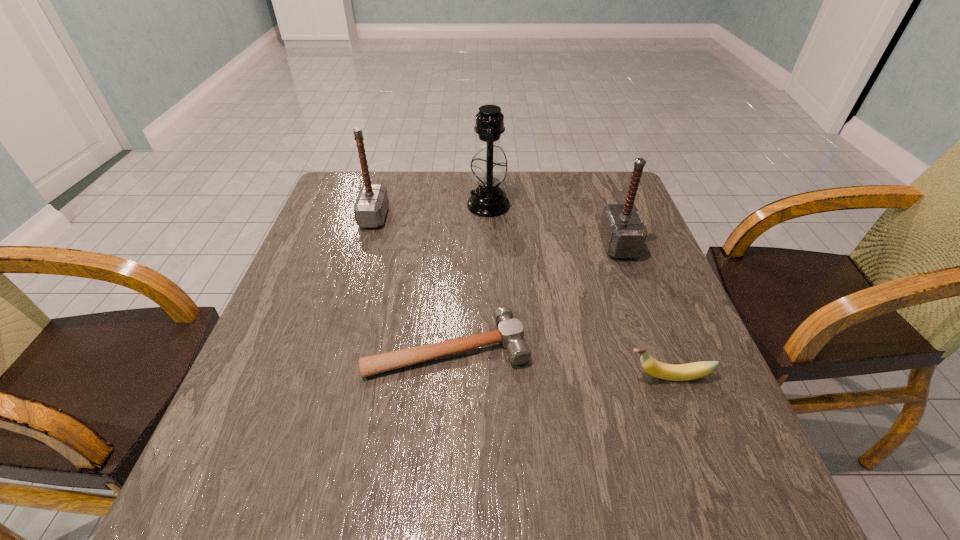
Identify the location of free space at the near edge. Image resolution: width=960 pixels, height=540 pixels. (623, 521).

Find the location of `free location at the left edge`. free location at the left edge is located at coordinates (311, 411).

The width and height of the screenshot is (960, 540). I want to click on vacant region at the right edge of the desktop, so click(609, 270).

At what (x,y) coordinates should I click in order to perform the action: click on vacant space at the far left corner of the desktop. Please return your answer as a coordinate pair (x, y). Looking at the image, I should click on (348, 208).

Find the location of `blank area at the near left corner`. blank area at the near left corner is located at coordinates [x=222, y=488].

This screenshot has width=960, height=540. Identify the location of vacant point located between the leftmost object and the shortest hammer. (411, 281).

The image size is (960, 540). I want to click on vacant point located between the rightmost hammer and the shortest object, so click(x=533, y=295).

Where is `unoccupied area between the leftmost hammer and the oil lamp`? This screenshot has height=540, width=960. unoccupied area between the leftmost hammer and the oil lamp is located at coordinates (431, 211).

Find the location of a particular element. This screenshot has height=540, width=960. free space between the leftmost object and the rightmost hammer is located at coordinates (496, 231).

Locate an element on the screen. The height and width of the screenshot is (540, 960). free space between the oil lamp and the leftmost object is located at coordinates (431, 211).